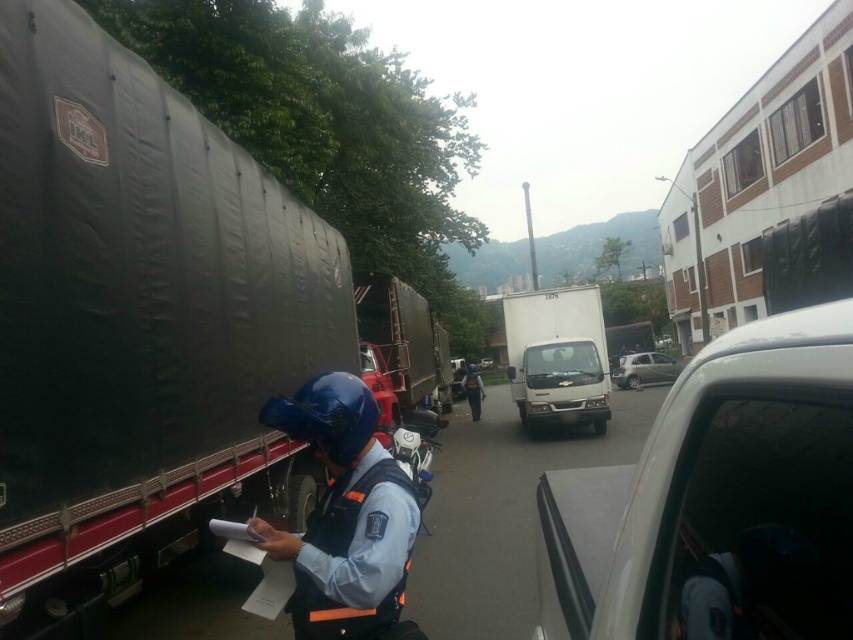
Is dark matte trailer truck at left thinner than white glossy car at center?

Correct, dark matte trailer truck at left's width is less than white glossy car at center's.

Between dark matte trailer truck at left and white glossy car at center, which one appears on the right side from the viewer's perspective?

From the viewer's perspective, white glossy car at center appears more on the right side.

The width and height of the screenshot is (853, 640). Identify the location of dark matte trailer truck at left. [x=140, y=321].

Can you confirm if silver metallic car at center is positioned to the right of dark blue uniform at center?

Yes, silver metallic car at center is to the right of dark blue uniform at center.

Does silver metallic car at center lie in front of dark blue uniform at center?

No.

Describe the element at coordinates (646, 369) in the screenshot. I see `silver metallic car at center` at that location.

Image resolution: width=853 pixels, height=640 pixels. Find the location of `silver metallic car at center`. silver metallic car at center is located at coordinates click(646, 369).

Can you confirm if dark matte trailer truck at left is taller than silver metallic car at center?

Yes, dark matte trailer truck at left is taller than silver metallic car at center.

Which is in front, point (26, 515) or point (677, 365)?

Positioned in front is point (26, 515).

You are a GUI agent. You are given a task and a screenshot of the screen. Output one action in this format:
    pyautogui.click(x=<x>, y=<y>)
    Task: Click on the dark matte trailer truck at left
    
    Given the screenshot: What is the action you would take?
    click(x=140, y=321)